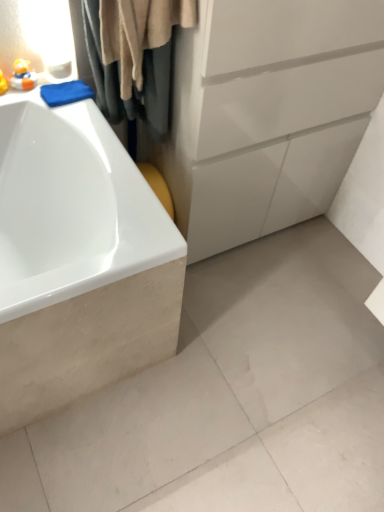
Where is `vacant point to the right of white glossy bathtub at left`? The height and width of the screenshot is (512, 384). vacant point to the right of white glossy bathtub at left is located at coordinates (240, 356).